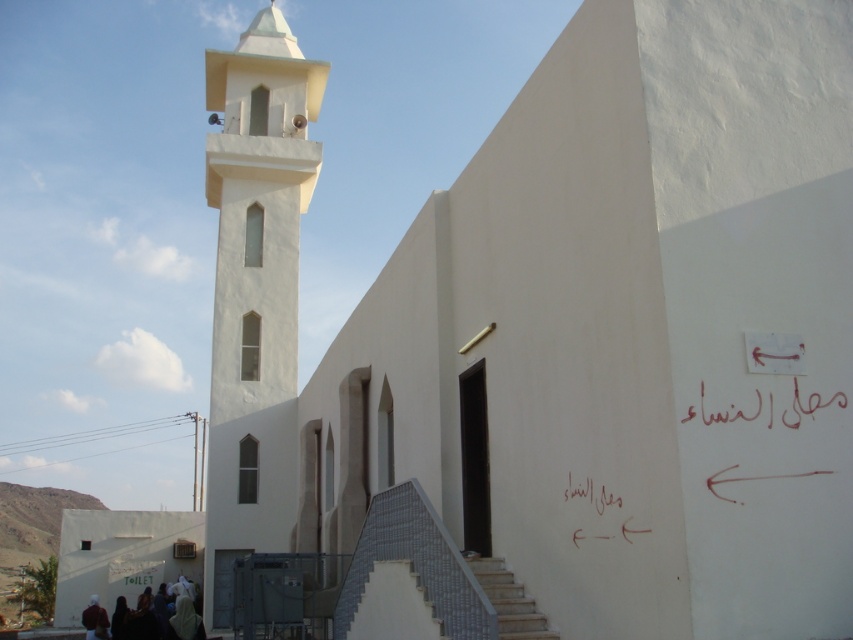
You are standing at the base of the mosque and want to reach the entrance marked by the dark doorway. You see the gray textured stairs at lower center and the handwritten red calligraphy at upper right. Which object is closer to the entrance?

The gray textured stairs at lower center is positioned under the handwritten red calligraphy at upper right, so the stairs are closer to the entrance than the calligraphy.

You are a visitor approaching the mosque and want to reach the entrance at the base of the minaret. The gray textured stairs at lower center and the handwritten red calligraphy at upper right are in your line of sight. Which object appears narrower from your perspective?

The gray textured stairs at lower center appears narrower than the handwritten red calligraphy at upper right.